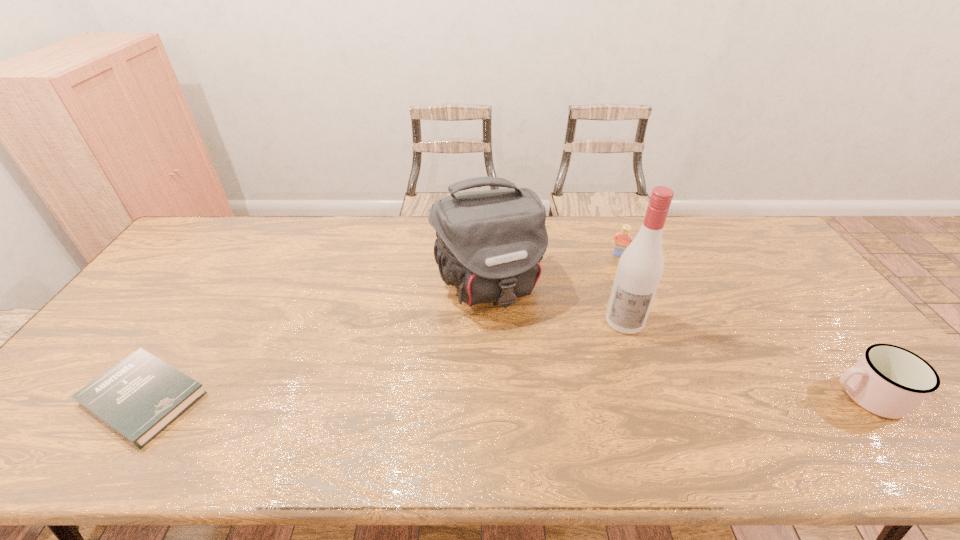
You are a GUI agent. You are given a task and a screenshot of the screen. Output one action in this format:
    pyautogui.click(x=<x>, y=<y>)
    Task: Click on the shoulder bag present at the far edge
    The height and width of the screenshot is (540, 960).
    Given the screenshot: What is the action you would take?
    pyautogui.click(x=489, y=244)

Find the location of `Lego at the far edge`. Lego at the far edge is located at coordinates (624, 238).

The image size is (960, 540). In order to click on book that is positioned at the near edge in this screenshot , I will do `click(139, 397)`.

Identify the location of mug that is at the near edge. (889, 381).

At what (x,y) coordinates should I click in order to perform the action: click on object at the left edge. Please return your answer as a coordinate pair (x, y). Image resolution: width=960 pixels, height=540 pixels. Looking at the image, I should click on (139, 397).

Locate an element on the screen. This screenshot has height=540, width=960. object that is at the right edge is located at coordinates (889, 381).

Identify the location of object that is at the near left corner. This screenshot has width=960, height=540. (139, 397).

Find the location of a particular element. object located at the near right corner is located at coordinates (889, 381).

In the image, there is a desktop. Identify the location of vacant space at the far edge. The height and width of the screenshot is (540, 960). (598, 253).

Find the location of a particular element. The width and height of the screenshot is (960, 540). vacant space at the near edge of the desktop is located at coordinates (817, 409).